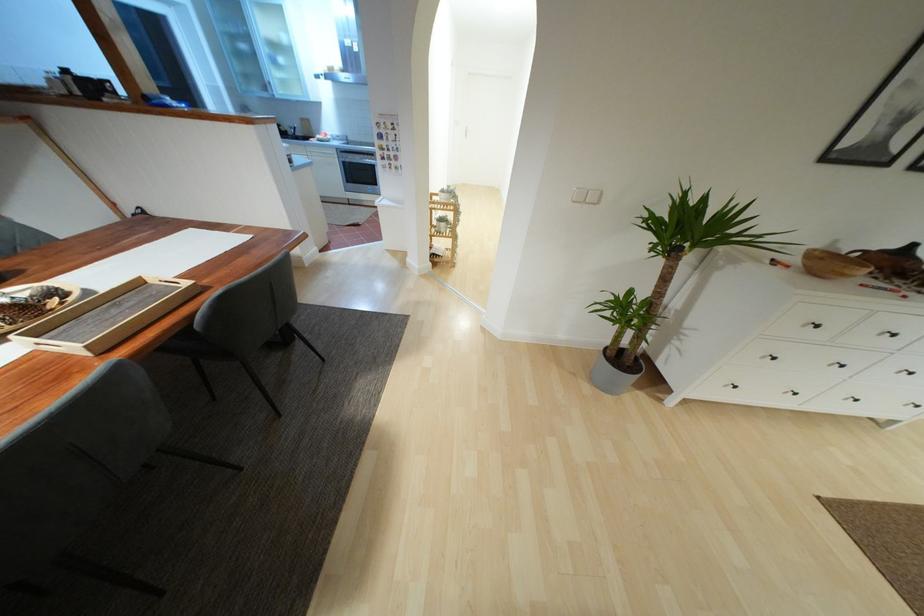
Find the location of a particular element. This screenshot has width=924, height=616. red marker is located at coordinates (884, 289).